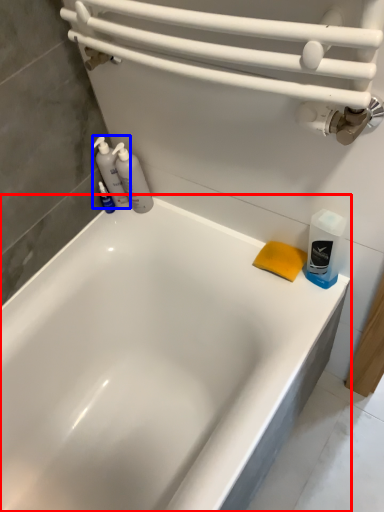
Question: Which of the following is the farthest to the observer, bathtub (highlighted by a red box) or cleaning product (highlighted by a blue box)?

Choices:
 (A) bathtub
 (B) cleaning product

Answer: (B)